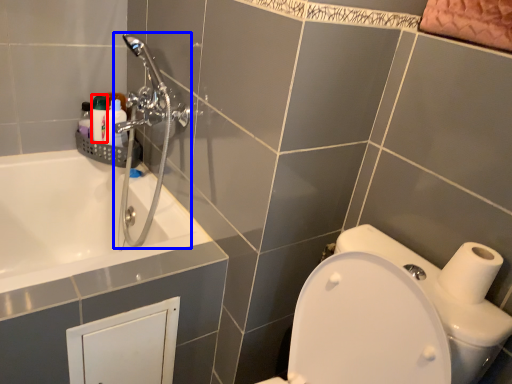
Question: Which object is further to the camera taking this photo, toiletry (highlighted by a red box) or shower (highlighted by a blue box)?

Choices:
 (A) toiletry
 (B) shower

Answer: (A)